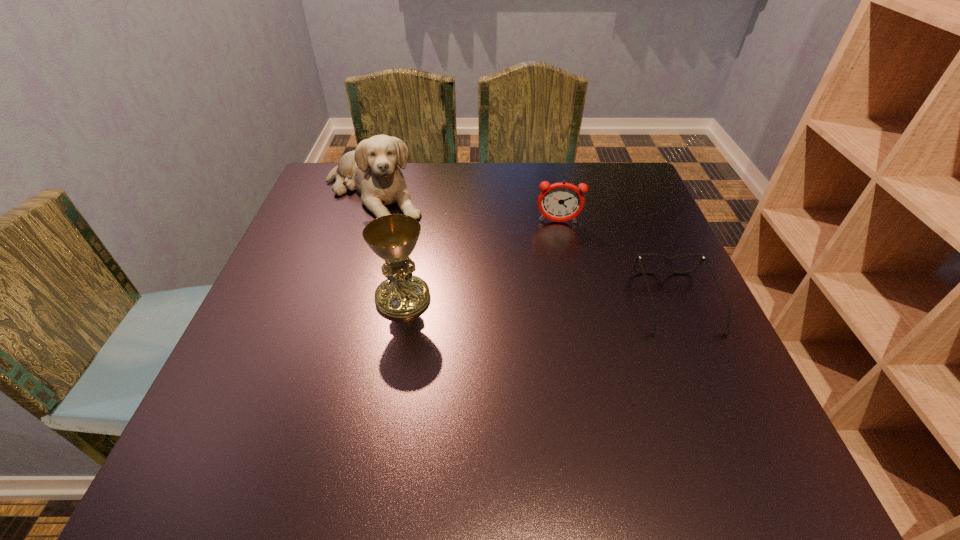
What are the coordinates of `vacant space on the desktop that is between the chalice and the shortest object and is positioned on the front-facing side of the third object from left to right` in the screenshot? It's located at (563, 301).

Locate an element on the screen. This screenshot has height=540, width=960. vacant space on the desktop that is between the chalice and the spectacles and is positioned on the front-facing side of the puppy is located at coordinates (510, 300).